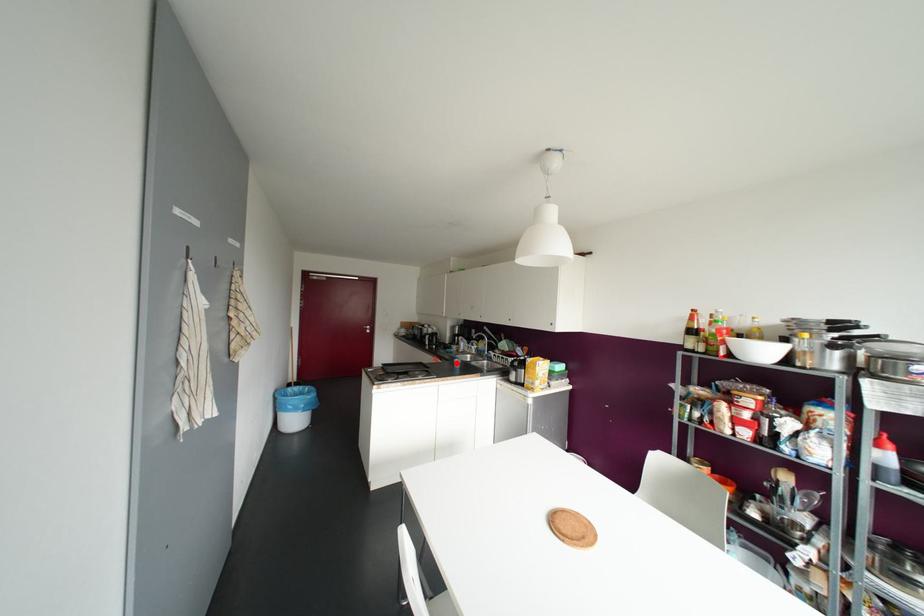
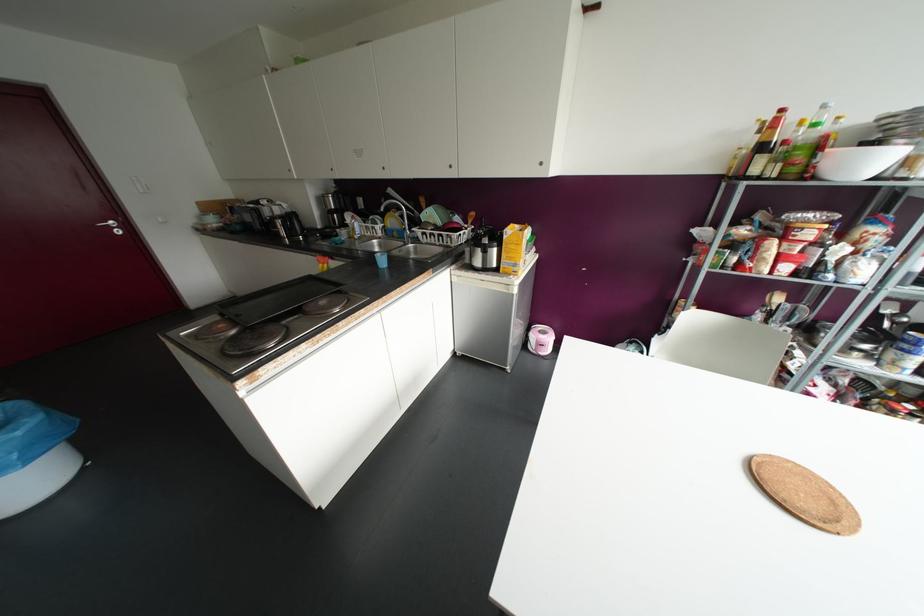
Question: I am providing you with two images of the same scene from different viewpoints. In image1, a red point is highlighted. Considering the same 3D point in image2, which of the following is correct?

Choices:
 (A) It is closer
 (B) It is farther

Answer: (A)